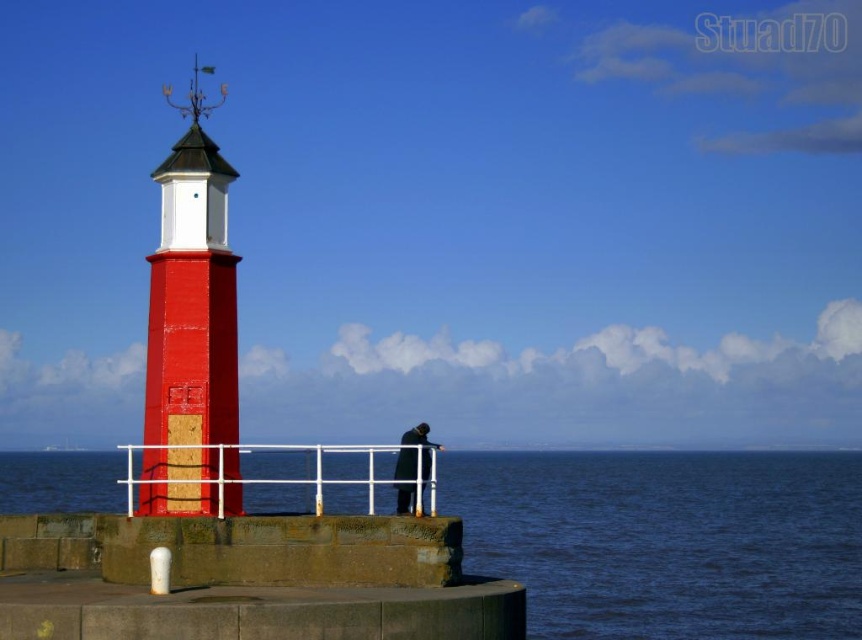
Question: Which of these objects is positioned closest to the white metal/rail at center?

Choices:
 (A) smooth concrete water at lower left
 (B) stone dock at center
 (C) smooth red lighthouse at left

Answer: (B)

Question: Which object is the farthest from the smooth red lighthouse at left?

Choices:
 (A) white metal/rail at center
 (B) dark gray coat at center

Answer: (A)

Question: Can you confirm if stone dock at center is smaller than smooth red lighthouse at left?

Choices:
 (A) no
 (B) yes

Answer: (B)

Question: Which point is farther to the camera?

Choices:
 (A) smooth concrete water at lower left
 (B) stone dock at center

Answer: (A)

Question: Is smooth red lighthouse at left below dark gray coat at center?

Choices:
 (A) no
 (B) yes

Answer: (A)

Question: Does smooth concrete water at lower left have a smaller size compared to stone dock at center?

Choices:
 (A) yes
 (B) no

Answer: (B)